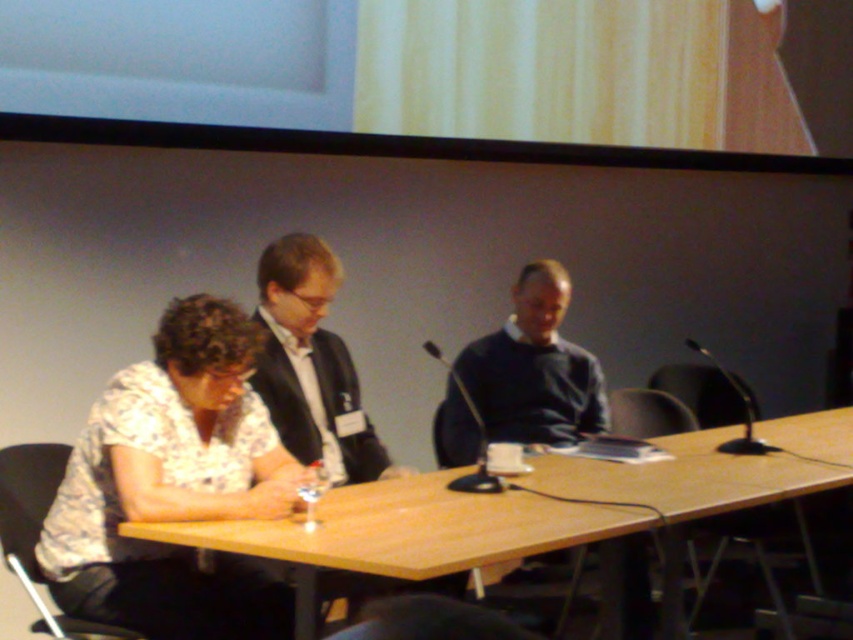
Does point (668, 538) lie behind point (747, 436)?

No, it is in front of (747, 436).

Locate an element on the screen. The height and width of the screenshot is (640, 853). wooden table at lower left is located at coordinates (537, 512).

Find the location of a particular element. The width and height of the screenshot is (853, 640). wooden table at lower left is located at coordinates (537, 512).

Is dark blue sweater at center closer to camera compared to black plastic microphone at center?

Yes, it is.

The image size is (853, 640). I want to click on dark blue sweater at center, so click(534, 369).

Locate an element on the screen. dark blue sweater at center is located at coordinates (534, 369).

Locate an element on the screen. The image size is (853, 640). dark blue sweater at center is located at coordinates (534, 369).

Is white floral shirt at center above black plastic microphone at center?

Actually, white floral shirt at center is below black plastic microphone at center.

Is point (178, 476) farther from camera compared to point (741, 404)?

No, (178, 476) is closer to viewer.

You are a GUI agent. You are given a task and a screenshot of the screen. Output one action in this format:
    pyautogui.click(x=<x>, y=<y>)
    Task: Click on the white floral shirt at center
    
    Given the screenshot: What is the action you would take?
    pyautogui.click(x=171, y=483)